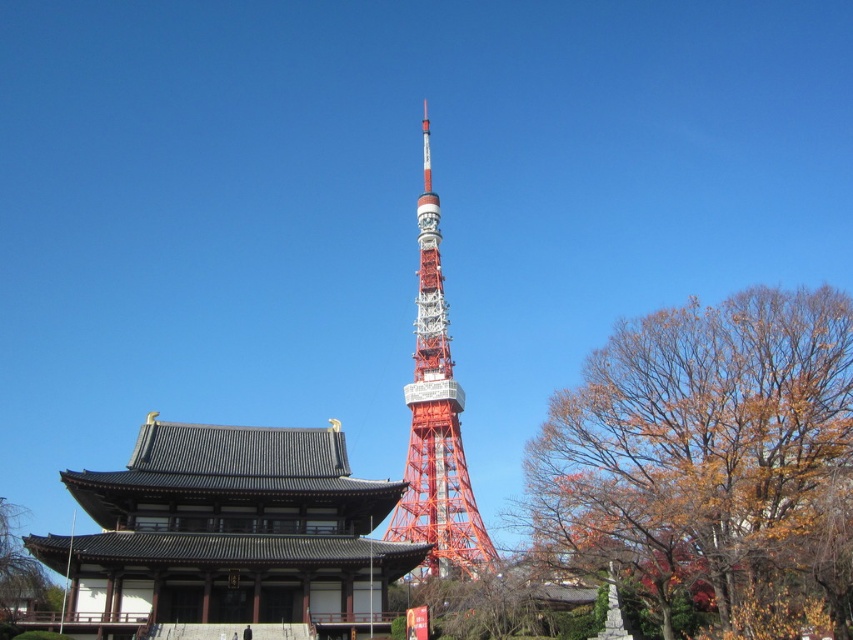
You are a tourist standing in front of the shiny black wood temple at lower left and want to take a photo of the autumn leaves at right. Which direction should you face to capture both the temple and the leaves in the same frame?

You should face to the right side of the shiny black wood temple at lower left to include both the temple and the autumn leaves at right in the photo, since the autumn leaves at right is positioned on the right side of the temple.

You are standing at the base of the Tokyo Tower and looking towards the traditional Japanese building. There are two points marked in the image. The first point is at coordinate point (722, 428) and the second is at point (433, 474). Which point is closer to you?

Point (722, 428) is closer to the camera than point (433, 474).